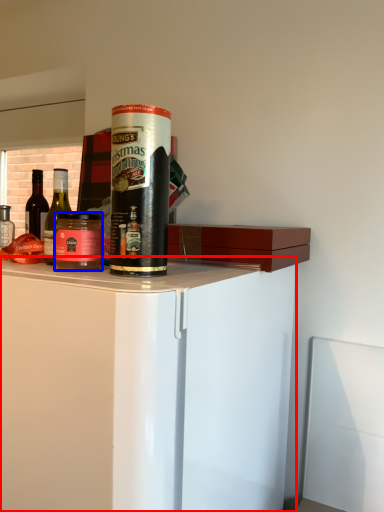
Question: Which point is closer to the camera, cabinetry (highlighted by a red box) or beverage (highlighted by a blue box)?

Choices:
 (A) cabinetry
 (B) beverage

Answer: (A)